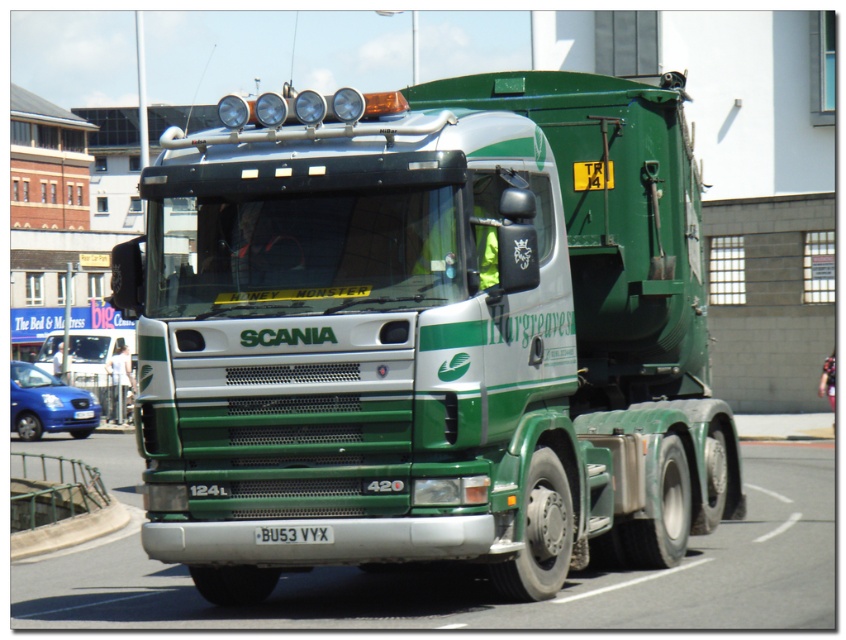
Which is behind, point (649, 161) or point (290, 536)?

The point (649, 161) is behind.

Locate an element on the screen. The width and height of the screenshot is (846, 640). green matte truck at center is located at coordinates (427, 333).